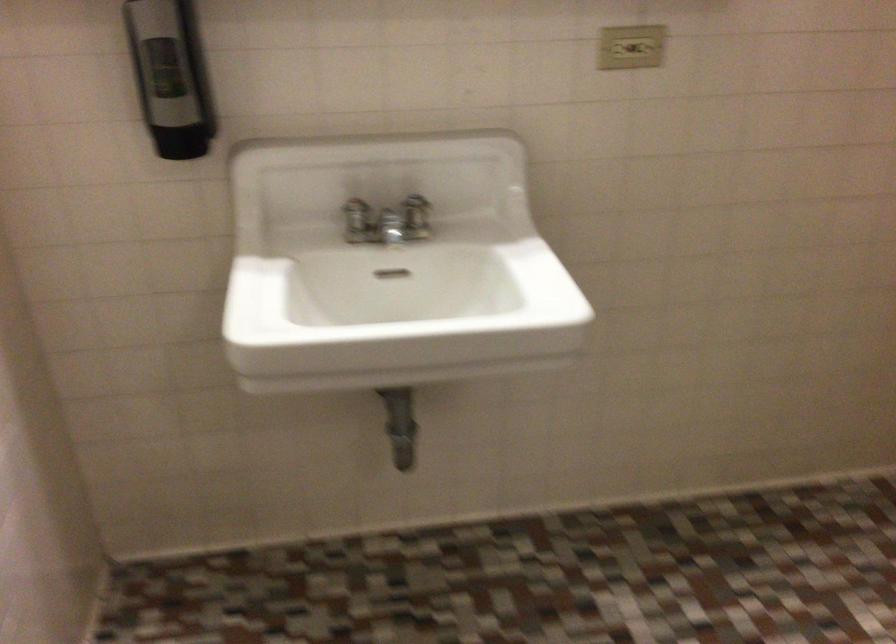
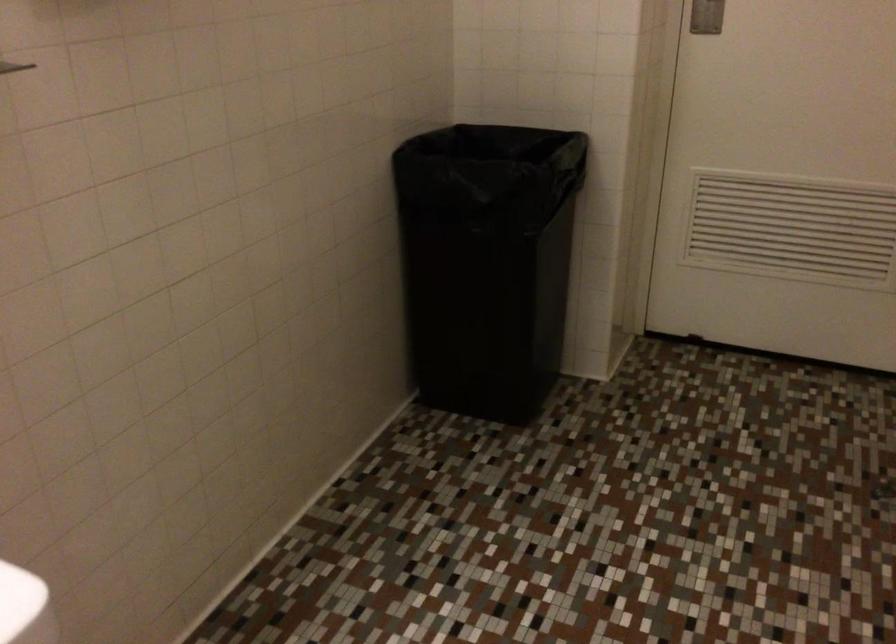
Question: The images are taken continuously from a first-person perspective. In which direction is your viewpoint rotating?

Choices:
 (A) Left
 (B) Right
 (C) Up
 (D) Down

Answer: (B)